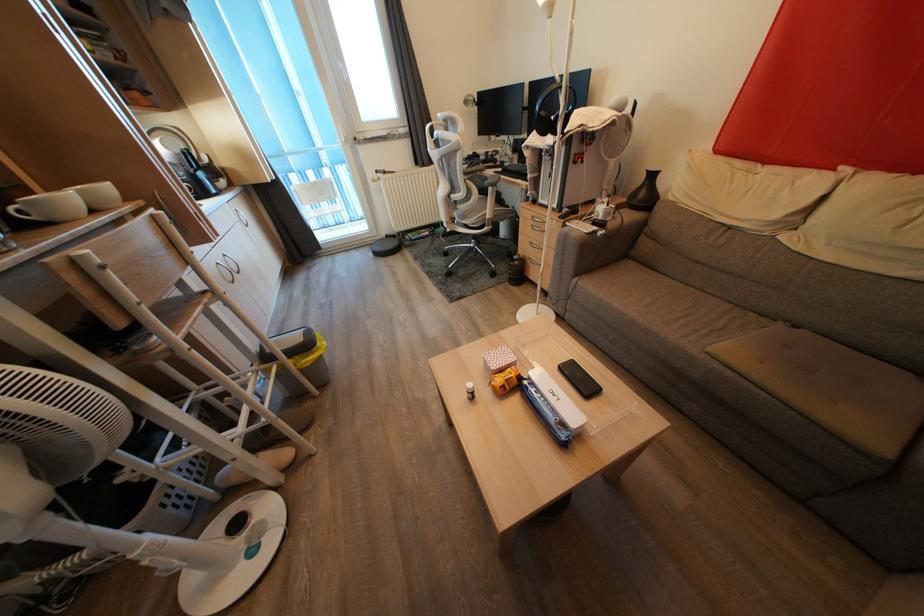
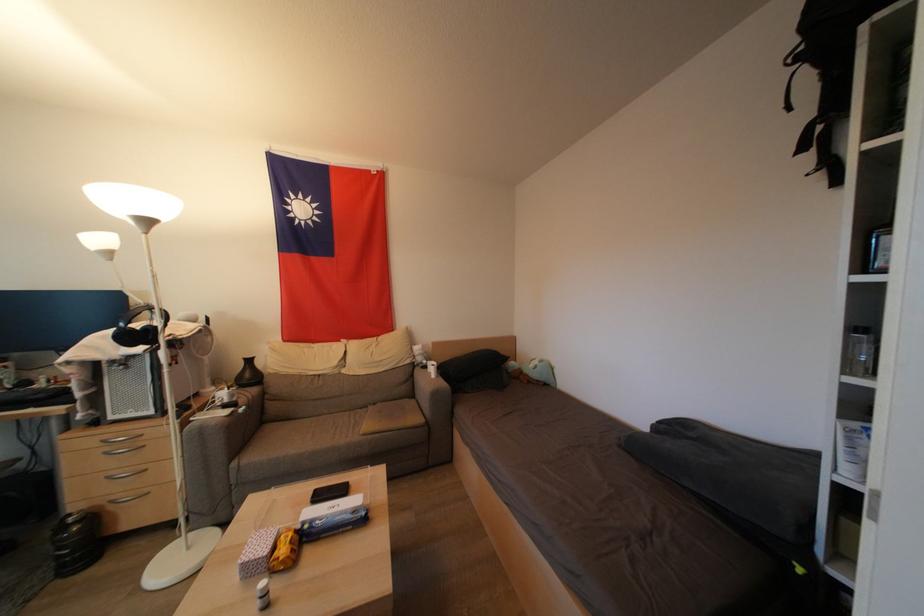
Find the pixel in the second image that matches (784,331) in the first image.

(375, 411)